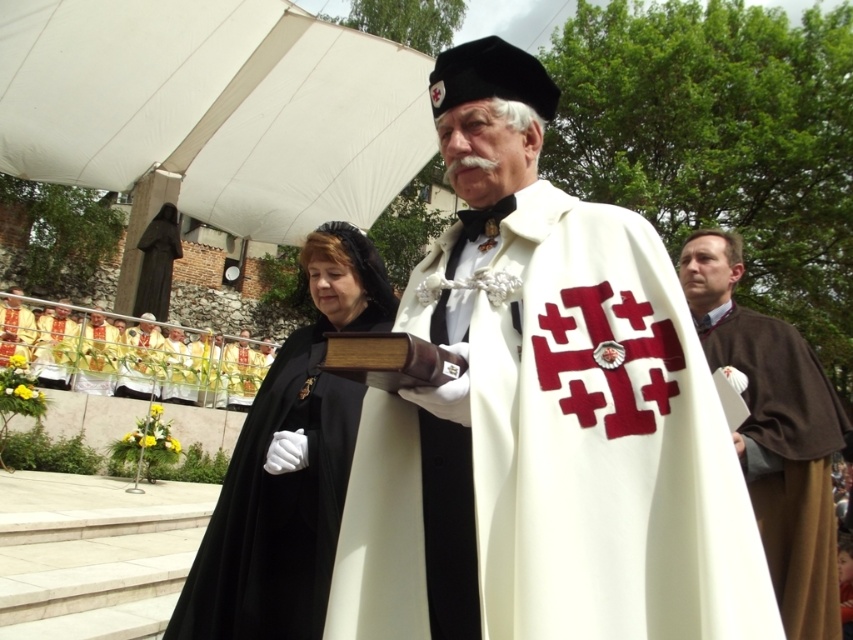
Who is more forward, (695, 573) or (115, 387)?

Positioned in front is point (695, 573).

The height and width of the screenshot is (640, 853). Describe the element at coordinates (543, 416) in the screenshot. I see `white matte cape at center` at that location.

Who is more forward, (535,353) or (126,333)?

Point (535,353) is more forward.

Identify the location of white matte cape at center. (543, 416).

Which of these two, matte gold cross at lower left or white woolen robe at center, stands taller?

With more height is white woolen robe at center.

Does matte gold cross at lower left have a lesser height compared to white woolen robe at center?

Yes, matte gold cross at lower left is shorter than white woolen robe at center.

Which is behind, point (57, 369) or point (28, 326)?

Positioned behind is point (28, 326).

Where is `matte gold cross at lower left`? Image resolution: width=853 pixels, height=640 pixels. matte gold cross at lower left is located at coordinates (55, 348).

Can you confirm if brown woolen robe at right is bigger than white woolen robe at center?

No, brown woolen robe at right is not bigger than white woolen robe at center.

Is brown woolen robe at right shorter than white woolen robe at center?

Yes.

Does point (834, 424) lie behind point (9, 323)?

That is False.

Where is `brown woolen robe at right`? brown woolen robe at right is located at coordinates (775, 433).